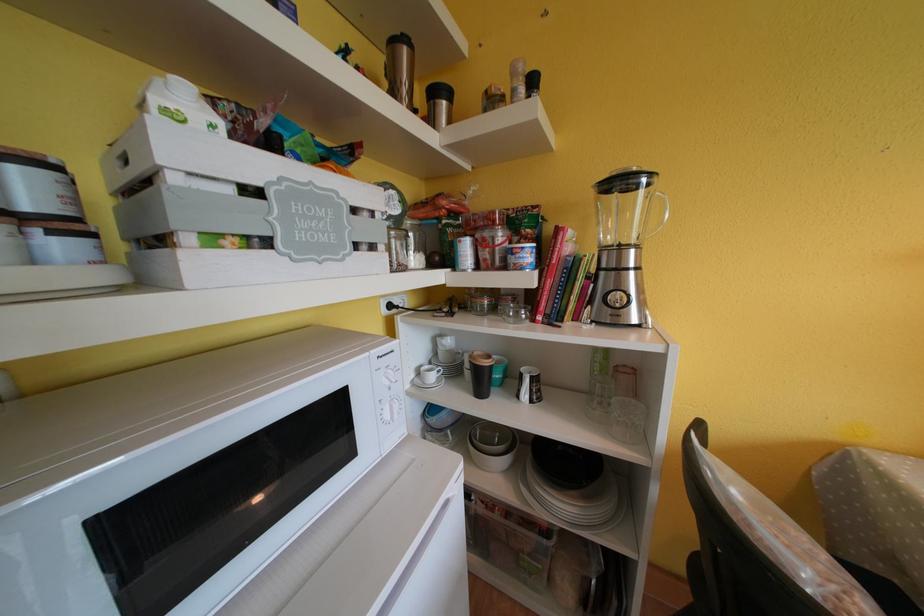
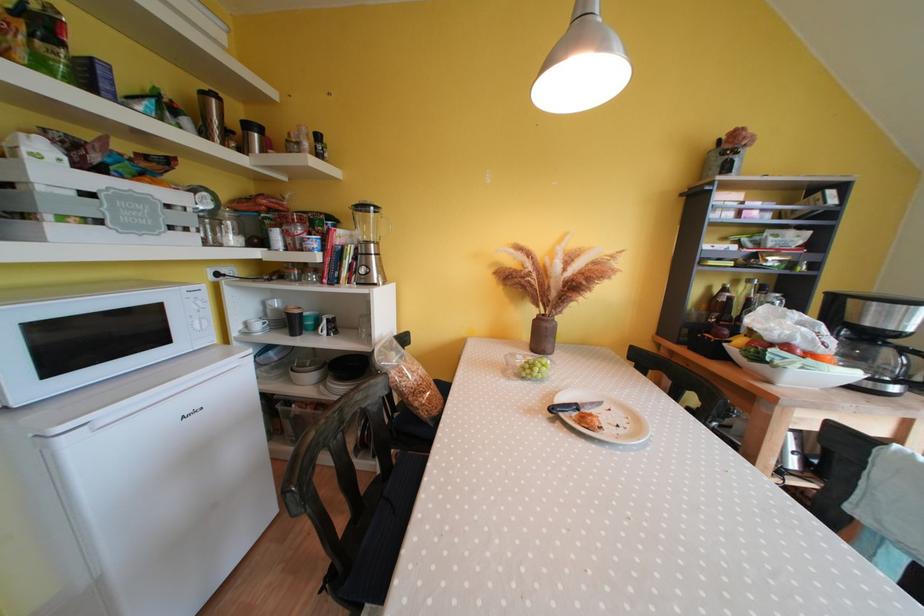
In the second image, find the point that corresponds to the point at 399,46 in the first image.

(209, 98)